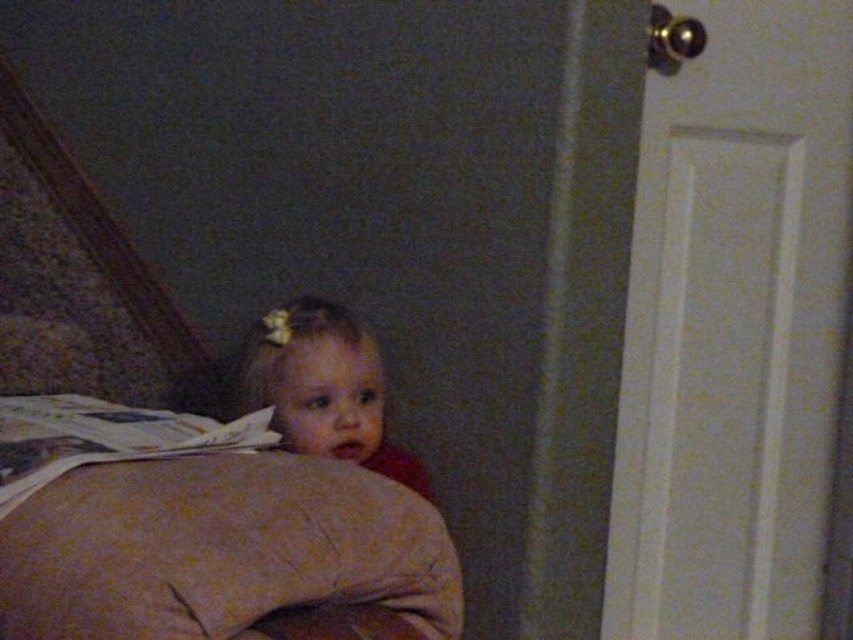
Does beige fabric pillow at lower left appear over smooth beige pillow at center?

No, beige fabric pillow at lower left is not above smooth beige pillow at center.

Does beige fabric pillow at lower left appear under smooth beige pillow at center?

Correct, beige fabric pillow at lower left is located below smooth beige pillow at center.

Who is more distant from viewer, (102, 605) or (345, 381)?

The point (345, 381) is behind.

At what (x,y) coordinates should I click in order to perform the action: click on beige fabric pillow at lower left. Please return your answer as a coordinate pair (x, y). Looking at the image, I should click on (224, 552).